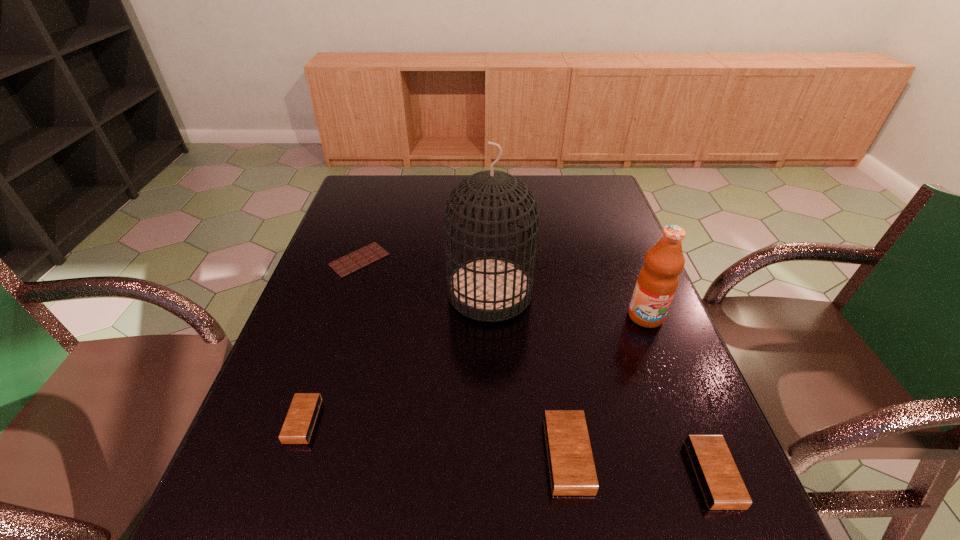
Where is `the second shortest object`? the second shortest object is located at coordinates (297, 429).

The height and width of the screenshot is (540, 960). I want to click on the shortest alarm clock, so click(297, 429).

Locate an element on the screen. the tallest alarm clock is located at coordinates (572, 471).

In order to click on the second alarm clock from left to right in this screenshot , I will do 572,471.

Identify the location of the fourth tallest object. (722, 486).

You are a GUI agent. You are given a task and a screenshot of the screen. Output one action in this format:
    pyautogui.click(x=<x>, y=<y>)
    Task: Click on the rightmost alarm clock
    Image resolution: width=960 pixels, height=540 pixels.
    Given the screenshot: What is the action you would take?
    pyautogui.click(x=722, y=486)

This screenshot has height=540, width=960. Find the location of `the second tallest object`. the second tallest object is located at coordinates (658, 279).

At what (x,y) coordinates should I click in order to perform the action: click on the tallest object. Please return your answer as a coordinate pair (x, y). Looking at the image, I should click on (489, 289).

I want to click on chocolate bar, so click(x=373, y=252).

Find the location of a particular element. Image resolution: width=960 pixels, height=540 pixels. vacant region located 0.060m on the front face of the leftmost alarm clock is located at coordinates (260, 421).